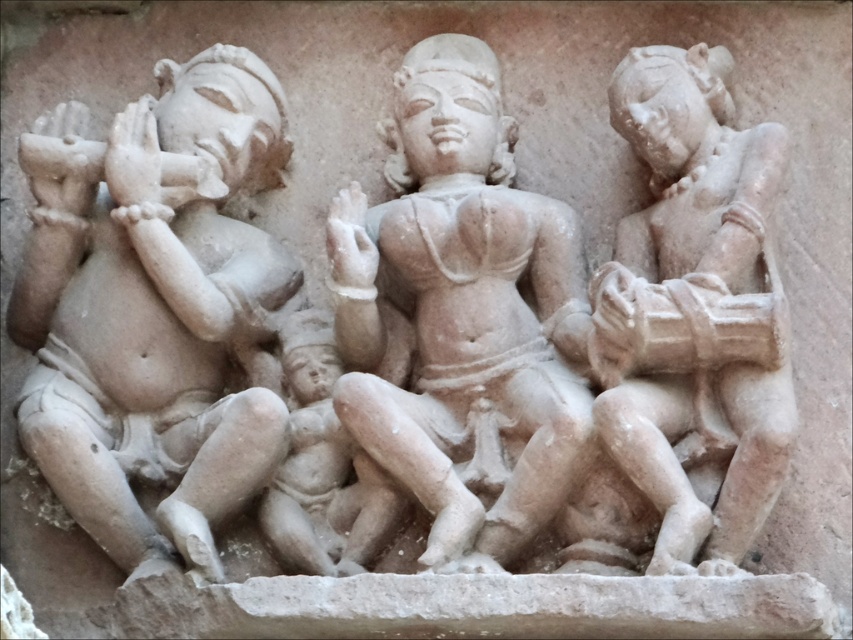
Is smooth beige statue at center bigger than smooth stone figure at right?

Yes.

Who is more distant from viewer, (456,515) or (635,225)?

The point (635,225) is more distant.

Where is `smooth beige statue at center`? The width and height of the screenshot is (853, 640). smooth beige statue at center is located at coordinates (459, 321).

Is point (212, 387) farther from viewer compared to point (463, 385)?

Yes, point (212, 387) is behind point (463, 385).

Which of these two, matte stone baby at left or smooth beige statue at center, stands shorter?

With less height is matte stone baby at left.

Is point (177, 289) farther from viewer compared to point (402, 189)?

No.

Where is `matte stone baby at left`? This screenshot has height=640, width=853. matte stone baby at left is located at coordinates pos(154,307).

Does matte stone baby at left have a smaller size compared to smooth stone figure at right?

Incorrect, matte stone baby at left is not smaller in size than smooth stone figure at right.

What do you see at coordinates (154, 307) in the screenshot? I see `matte stone baby at left` at bounding box center [154, 307].

Between point (160, 148) and point (699, 529), which one is positioned in front?

Positioned in front is point (699, 529).

Identify the location of matte stone baby at left. The image size is (853, 640). (154, 307).